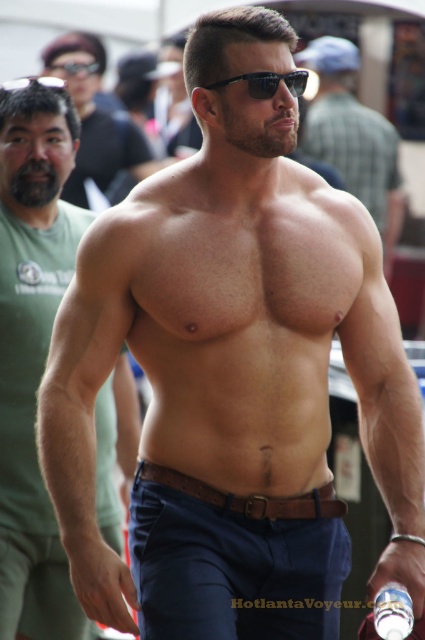
Question: Is muscular skin at center above sunglasses at center?

Choices:
 (A) yes
 (B) no

Answer: (A)

Question: Does muscular skin at center appear on the left side of brown leather belt at center?

Choices:
 (A) yes
 (B) no

Answer: (B)

Question: Which object appears farthest from the camera in this image?

Choices:
 (A) matte black sunglasses at upper center
 (B) sunglasses at center

Answer: (A)

Question: Which point is closer to the camera?

Choices:
 (A) (388, 278)
 (B) (258, 77)
 (C) (47, 60)

Answer: (B)

Question: Observing the image, what is the correct spatial positioning of matte black sunglasses at upper center in reference to brown leather belt at center?

Choices:
 (A) right
 (B) left

Answer: (B)

Question: Which of these objects is positioned closest to the matte brown belt at center?

Choices:
 (A) sunglasses at center
 (B) matte black sunglasses at upper center
 (C) brown leather belt at center
 (D) muscular skin at center

Answer: (C)